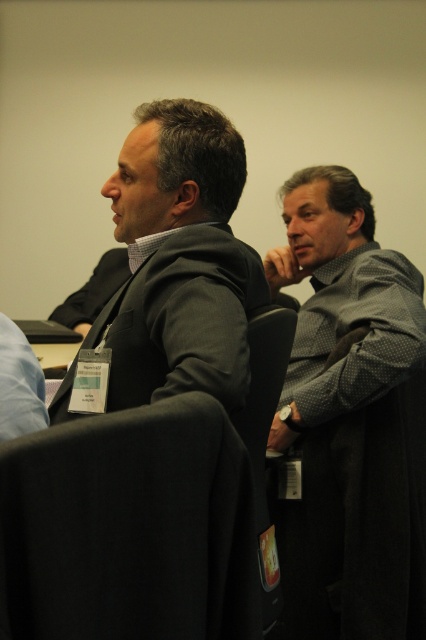
Question: Considering the relative positions of black fabric chair at center and gray dotted shirt at center in the image provided, where is black fabric chair at center located with respect to gray dotted shirt at center?

Choices:
 (A) right
 (B) left

Answer: (A)

Question: Among these objects, which one is farthest from the camera?

Choices:
 (A) black fabric chair at lower left
 (B) dark gray suit at center
 (C) gray dotted shirt at center

Answer: (C)

Question: Does black fabric chair at lower left appear under gray dotted shirt at center?

Choices:
 (A) yes
 (B) no

Answer: (A)

Question: Which object is the closest to the black fabric chair at lower left?

Choices:
 (A) gray dotted shirt at center
 (B) dark gray suit at center

Answer: (B)

Question: Does black fabric chair at center have a greater width compared to gray dotted shirt at center?

Choices:
 (A) yes
 (B) no

Answer: (B)

Question: Which point is closer to the camera?

Choices:
 (A) (189, 108)
 (B) (324, 381)
 (C) (321, 552)
 (D) (14, 595)

Answer: (D)